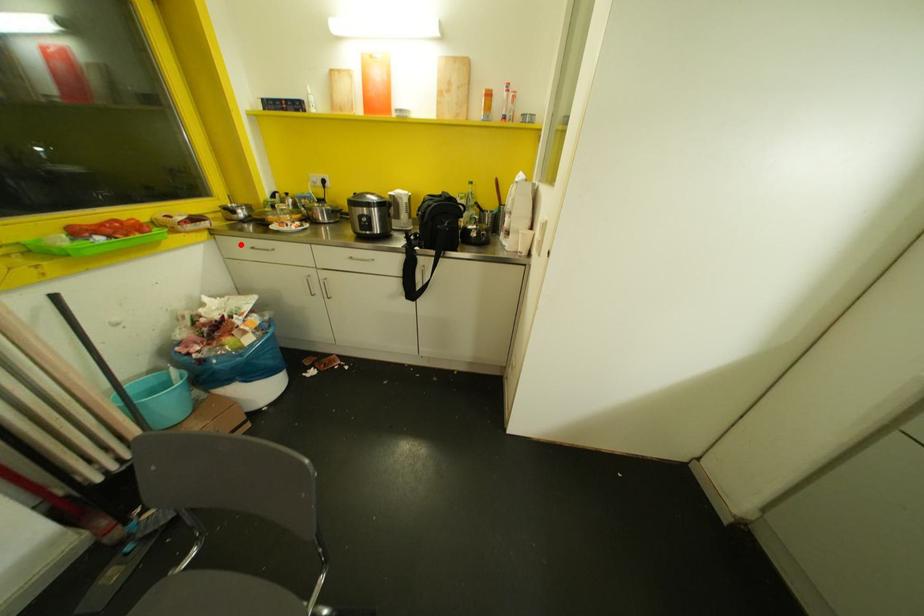
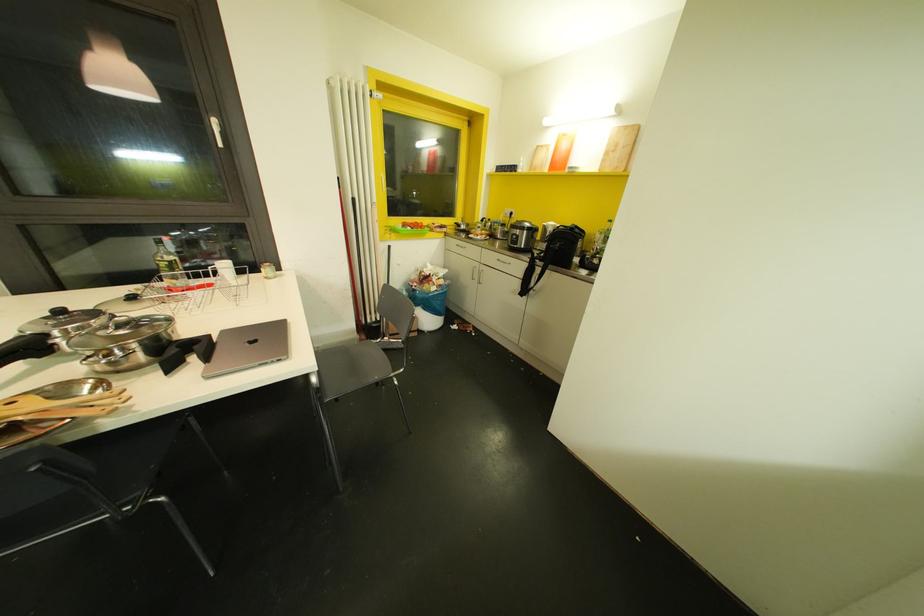
Question: I am providing you with two images of the same scene from different viewpoints. A red point is marked on the first image. Is the red point's position out of view in image 2?

Choices:
 (A) Yes
 (B) No

Answer: (B)